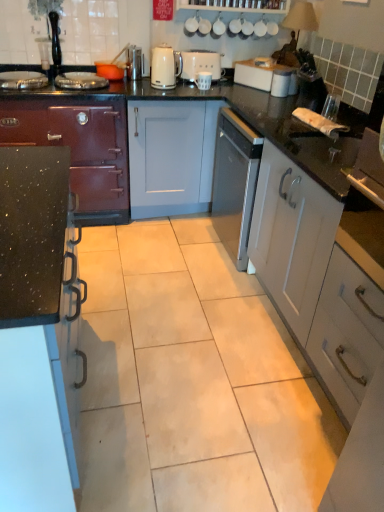
The image size is (384, 512). I want to click on vacant space underneath white glossy kettle at upper center (from a real-world perspective), so click(x=177, y=88).